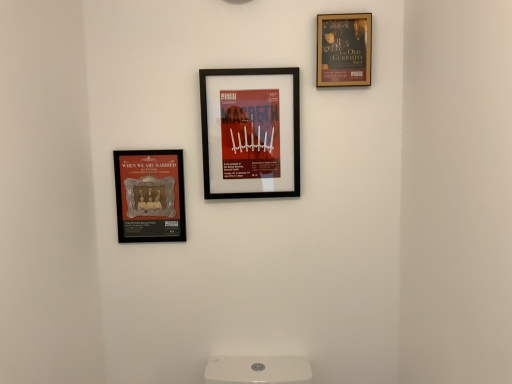
I want to click on gold-framed poster at upper right, which ranks as the 3th picture frame in left-to-right order, so pyautogui.click(x=344, y=50).

What do you see at coordinates (250, 132) in the screenshot? Image resolution: width=512 pixels, height=384 pixels. I see `matte black picture frame at center, marked as the 2th picture frame in a right-to-left arrangement` at bounding box center [250, 132].

At what (x,y) coordinates should I click in order to perform the action: click on gold-framed poster at upper right, the first picture frame positioned from the right. Please return your answer as a coordinate pair (x, y). This screenshot has width=512, height=384. Looking at the image, I should click on (344, 50).

Considering the points (342, 53) and (233, 72), which point is in front, point (342, 53) or point (233, 72)?

The point (233, 72) is closer.

Between gold-framed poster at upper right, the first picture frame positioned from the right, and matte black picture frame at center, marked as the 2th picture frame in a right-to-left arrangement, which one has smaller size?

gold-framed poster at upper right, the first picture frame positioned from the right, is smaller.

Based on the photo, is the depth of gold-framed poster at upper right, the first picture frame positioned from the right, less than that of matte black picture frame at center, marked as the 2th picture frame in a right-to-left arrangement?

Yes, gold-framed poster at upper right, the first picture frame positioned from the right, is closer to the camera.

Can you confirm if matte black picture frame at center, marked as the 2th picture frame in a right-to-left arrangement, is bigger than gold-framed poster at upper right, which ranks as the 3th picture frame in left-to-right order?

Yes, matte black picture frame at center, marked as the 2th picture frame in a right-to-left arrangement, is bigger than gold-framed poster at upper right, which ranks as the 3th picture frame in left-to-right order.

Considering the sizes of matte black picture frame at center, acting as the second picture frame starting from the left, and gold-framed poster at upper right, which ranks as the 3th picture frame in left-to-right order, in the image, is matte black picture frame at center, acting as the second picture frame starting from the left, taller or shorter than gold-framed poster at upper right, which ranks as the 3th picture frame in left-to-right order,?

Considering their sizes, matte black picture frame at center, acting as the second picture frame starting from the left, has more height than gold-framed poster at upper right, which ranks as the 3th picture frame in left-to-right order.

Is matte black picture frame at center, acting as the second picture frame starting from the left, beside gold-framed poster at upper right, which ranks as the 3th picture frame in left-to-right order?

No, matte black picture frame at center, acting as the second picture frame starting from the left, is not with gold-framed poster at upper right, which ranks as the 3th picture frame in left-to-right order.

Which object is thinner, matte black picture frame at center, acting as the second picture frame starting from the left, or gold-framed poster at upper right, the first picture frame positioned from the right?

Thinner between the two is gold-framed poster at upper right, the first picture frame positioned from the right.

Considering the sizes of matte black picture frame at center, marked as the 2th picture frame in a right-to-left arrangement, and matte gold plaque at left, the first picture frame positioned from the left, in the image, is matte black picture frame at center, marked as the 2th picture frame in a right-to-left arrangement, bigger or smaller than matte gold plaque at left, the first picture frame positioned from the left,?

In the image, matte black picture frame at center, marked as the 2th picture frame in a right-to-left arrangement, appears to be larger than matte gold plaque at left, the first picture frame positioned from the left.

From a real-world perspective, is matte black picture frame at center, marked as the 2th picture frame in a right-to-left arrangement, physically above matte gold plaque at left, the 3th picture frame when ordered from right to left?

Yes.

Is matte gold plaque at left, the first picture frame positioned from the left, completely or partially inside matte black picture frame at center, acting as the second picture frame starting from the left?

No, matte gold plaque at left, the first picture frame positioned from the left, is not surrounded by matte black picture frame at center, acting as the second picture frame starting from the left.

Is gold-framed poster at upper right, which ranks as the 3th picture frame in left-to-right order, outside of matte gold plaque at left, the 3th picture frame when ordered from right to left?

Yes, gold-framed poster at upper right, which ranks as the 3th picture frame in left-to-right order, is not within matte gold plaque at left, the 3th picture frame when ordered from right to left.

Where is `the 2nd picture frame above the matte gold plaque at left, the first picture frame positioned from the left (from the image's perspective)`? The height and width of the screenshot is (384, 512). the 2nd picture frame above the matte gold plaque at left, the first picture frame positioned from the left (from the image's perspective) is located at coordinates (344, 50).

Is point (368, 13) in front of point (170, 228)?

That is True.

In terms of height, does gold-framed poster at upper right, which ranks as the 3th picture frame in left-to-right order, look taller or shorter compared to matte gold plaque at left, the first picture frame positioned from the left?

gold-framed poster at upper right, which ranks as the 3th picture frame in left-to-right order, is shorter than matte gold plaque at left, the first picture frame positioned from the left.

Is matte gold plaque at left, the 3th picture frame when ordered from right to left, situated inside matte black picture frame at center, marked as the 2th picture frame in a right-to-left arrangement, or outside?

matte gold plaque at left, the 3th picture frame when ordered from right to left, is located beyond the bounds of matte black picture frame at center, marked as the 2th picture frame in a right-to-left arrangement.

Is point (155, 196) closer or farther from the camera than point (243, 131)?

Point (155, 196) is positioned farther from the camera compared to point (243, 131).

Which object is wider, matte gold plaque at left, the first picture frame positioned from the left, or matte black picture frame at center, marked as the 2th picture frame in a right-to-left arrangement?

matte black picture frame at center, marked as the 2th picture frame in a right-to-left arrangement, is wider.

Choose the correct answer: Is matte gold plaque at left, the first picture frame positioned from the left, inside gold-framed poster at upper right, which ranks as the 3th picture frame in left-to-right order, or outside it?

The correct answer is: outside.

Can you confirm if matte gold plaque at left, the first picture frame positioned from the left, is taller than gold-framed poster at upper right, which ranks as the 3th picture frame in left-to-right order?

Correct, matte gold plaque at left, the first picture frame positioned from the left, is much taller as gold-framed poster at upper right, which ranks as the 3th picture frame in left-to-right order.

From a real-world perspective, between matte gold plaque at left, the 3th picture frame when ordered from right to left, and gold-framed poster at upper right, the first picture frame positioned from the right, who is vertically higher?

gold-framed poster at upper right, the first picture frame positioned from the right.

Is point (131, 156) closer or farther from the camera than point (357, 27)?

Point (131, 156) appears to be farther away from the viewer than point (357, 27).

Where is `picture frame that is the 1st one when counting downward from the gold-framed poster at upper right, the first picture frame positioned from the right (from the image's perspective)`? The width and height of the screenshot is (512, 384). picture frame that is the 1st one when counting downward from the gold-framed poster at upper right, the first picture frame positioned from the right (from the image's perspective) is located at coordinates (250, 132).

Identify the location of picture frame in front of the matte black picture frame at center, acting as the second picture frame starting from the left. (344, 50).

When comparing their distances from gold-framed poster at upper right, which ranks as the 3th picture frame in left-to-right order, does matte black picture frame at center, acting as the second picture frame starting from the left, or matte gold plaque at left, the 3th picture frame when ordered from right to left, seem closer?

Based on the image, matte black picture frame at center, acting as the second picture frame starting from the left, appears to be nearer to gold-framed poster at upper right, which ranks as the 3th picture frame in left-to-right order.

Looking at the image, which one is located closer to gold-framed poster at upper right, which ranks as the 3th picture frame in left-to-right order, matte gold plaque at left, the 3th picture frame when ordered from right to left, or matte black picture frame at center, acting as the second picture frame starting from the left?

matte black picture frame at center, acting as the second picture frame starting from the left, is positioned closer to the anchor gold-framed poster at upper right, which ranks as the 3th picture frame in left-to-right order.

Based on their spatial positions, is matte gold plaque at left, the 3th picture frame when ordered from right to left, or gold-framed poster at upper right, the first picture frame positioned from the right, closer to matte black picture frame at center, acting as the second picture frame starting from the left?

matte gold plaque at left, the 3th picture frame when ordered from right to left.

When comparing their distances from matte gold plaque at left, the 3th picture frame when ordered from right to left, does matte black picture frame at center, marked as the 2th picture frame in a right-to-left arrangement, or gold-framed poster at upper right, which ranks as the 3th picture frame in left-to-right order, seem closer?

The object closer to matte gold plaque at left, the 3th picture frame when ordered from right to left, is matte black picture frame at center, marked as the 2th picture frame in a right-to-left arrangement.

When comparing their distances from matte black picture frame at center, acting as the second picture frame starting from the left, does gold-framed poster at upper right, which ranks as the 3th picture frame in left-to-right order, or matte gold plaque at left, the 3th picture frame when ordered from right to left, seem further?

gold-framed poster at upper right, which ranks as the 3th picture frame in left-to-right order, is positioned further to the anchor matte black picture frame at center, acting as the second picture frame starting from the left.

From the image, which object appears to be farther from matte gold plaque at left, the 3th picture frame when ordered from right to left, gold-framed poster at upper right, which ranks as the 3th picture frame in left-to-right order, or matte black picture frame at center, acting as the second picture frame starting from the left?

gold-framed poster at upper right, which ranks as the 3th picture frame in left-to-right order, lies further to matte gold plaque at left, the 3th picture frame when ordered from right to left, than the other object.

The image size is (512, 384). In order to click on picture frame situated between matte gold plaque at left, the first picture frame positioned from the left, and gold-framed poster at upper right, the first picture frame positioned from the right, from left to right in this screenshot , I will do `click(250, 132)`.